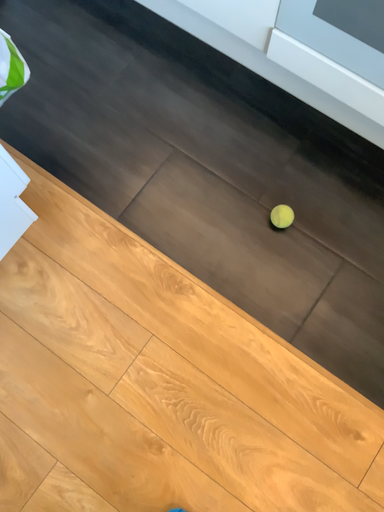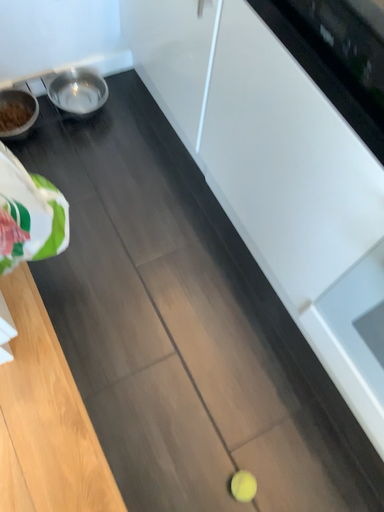
Question: Which way did the camera rotate in the video?

Choices:
 (A) rotated upward
 (B) rotated downward

Answer: (A)